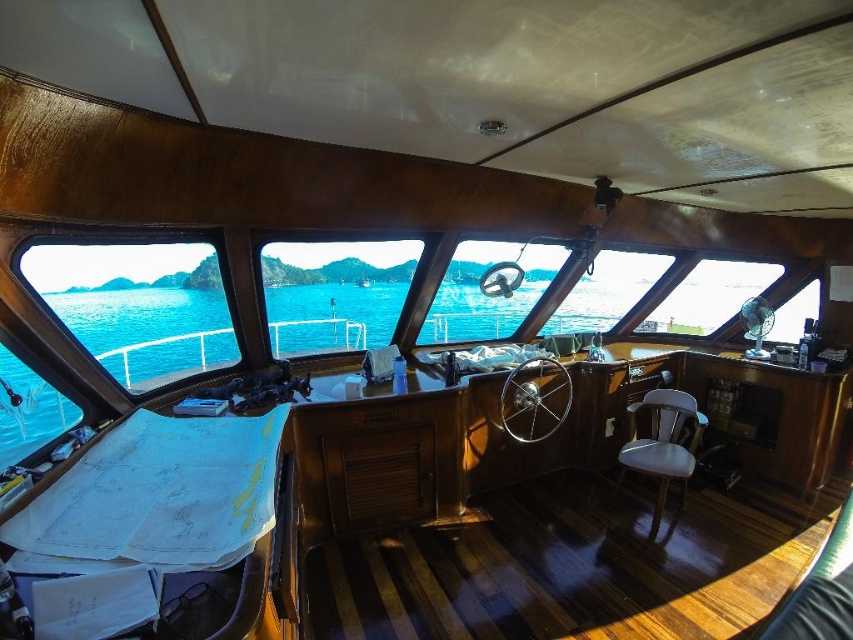
The image size is (853, 640). In order to click on blue water at center in this screenshot , I will do coord(137,307).

Does blue water at center have a smaller size compared to transparent glass window at left?

Result: Yes.

Between point (30, 451) and point (202, 316), which one is positioned behind?

Positioned behind is point (202, 316).

Locate an element on the screen. The width and height of the screenshot is (853, 640). blue water at center is located at coordinates (137, 307).

Identify the location of transparent glass window at left. (136, 307).

Does transparent glass window at left have a lesser width compared to white leather chair at lower right?

Yes, transparent glass window at left is thinner than white leather chair at lower right.

Where is `transparent glass window at left`? Image resolution: width=853 pixels, height=640 pixels. transparent glass window at left is located at coordinates (136, 307).